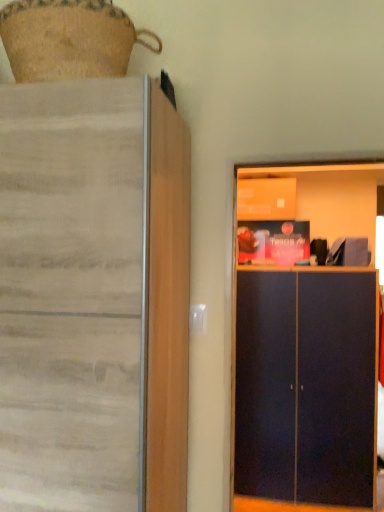
I want to click on free space above dark blue matte cabinet at right (from a real-world perspective), so click(324, 159).